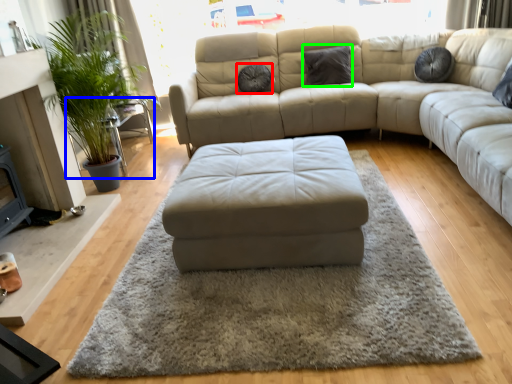
Question: Based on their relative distances, which object is nearer to pillow (highlighted by a red box)? Choose from side table (highlighted by a blue box) and pillow (highlighted by a green box).

Choices:
 (A) side table
 (B) pillow

Answer: (B)